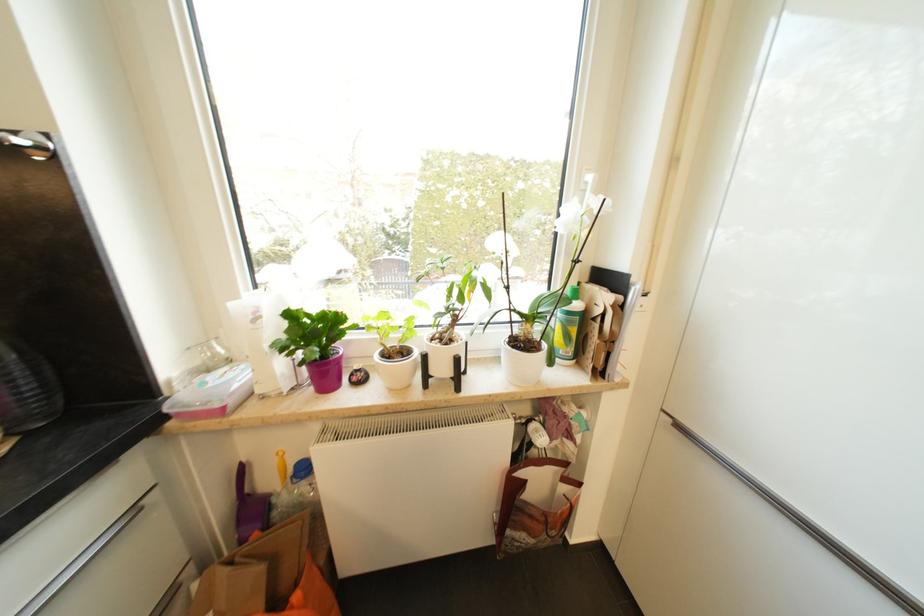
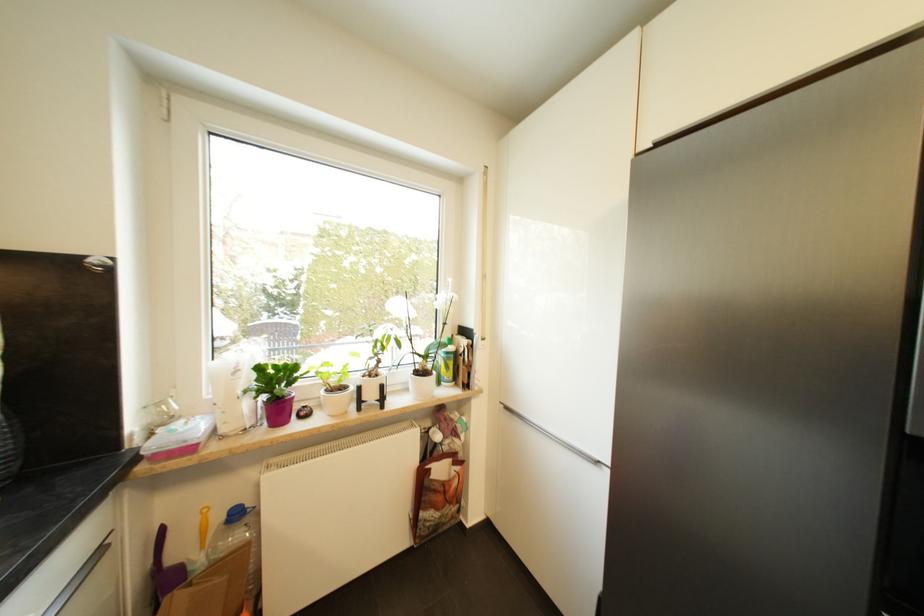
Question: I am providing you with two images of the same scene from different viewpoints. Which of the following objects are not visible in image2?

Choices:
 (A) white flower pot
 (B) silver drawer handle
 (C) green spray bottle
 (D) none of these

Answer: (D)